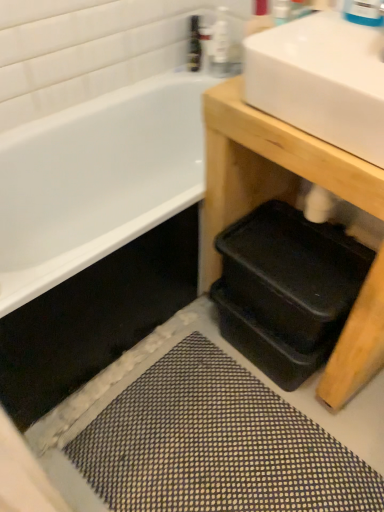
What is the approximate width of blue glossy faucet at upper right?

blue glossy faucet at upper right is 3.57 inches in width.

I want to click on clear plastic bottle at upper center, which is the second toiletry from left to right, so click(x=220, y=46).

The height and width of the screenshot is (512, 384). What are the coordinates of `blue glossy faucet at upper right` in the screenshot? It's located at (364, 12).

Is translucent plastic bottle at upper center, which ranks as the second toiletry in right-to-left order, in front of or behind textured gray bath mat at lower center in the image?

translucent plastic bottle at upper center, which ranks as the second toiletry in right-to-left order, is behind textured gray bath mat at lower center.

Looking at the image, does translucent plastic bottle at upper center, which is counted as the first toiletry, starting from the left, seem bigger or smaller compared to textured gray bath mat at lower center?

Considering their sizes, translucent plastic bottle at upper center, which is counted as the first toiletry, starting from the left, takes up less space than textured gray bath mat at lower center.

Between translucent plastic bottle at upper center, which ranks as the second toiletry in right-to-left order, and textured gray bath mat at lower center, which one has more height?

translucent plastic bottle at upper center, which ranks as the second toiletry in right-to-left order.

From a real-world perspective, which is physically below, translucent plastic bottle at upper center, which is counted as the first toiletry, starting from the left, or textured gray bath mat at lower center?

textured gray bath mat at lower center.

From a real-world perspective, is black plastic trays at lower right below white glossy sink at upper right?

Yes, from a real-world perspective, black plastic trays at lower right is below white glossy sink at upper right.

Identify the location of table below the white glossy sink at upper right (from a real-world perspective). Image resolution: width=384 pixels, height=512 pixels. (268, 167).

Can you confirm if black plastic trays at lower right is taller than white glossy sink at upper right?

Yes.

Considering the sizes of black plastic trays at lower right and white glossy sink at upper right in the image, is black plastic trays at lower right wider or thinner than white glossy sink at upper right?

Clearly, black plastic trays at lower right has more width compared to white glossy sink at upper right.

Is translucent plastic bottle at upper center, which is counted as the first toiletry, starting from the left, turned away from blue glossy faucet at upper right?

translucent plastic bottle at upper center, which is counted as the first toiletry, starting from the left, does not have its back to blue glossy faucet at upper right.

Does translucent plastic bottle at upper center, which is counted as the first toiletry, starting from the left, have a lesser height compared to blue glossy faucet at upper right?

Incorrect, the height of translucent plastic bottle at upper center, which is counted as the first toiletry, starting from the left, does not fall short of that of blue glossy faucet at upper right.

Where is `faucet that is in front of the translucent plastic bottle at upper center, which is counted as the first toiletry, starting from the left`? The height and width of the screenshot is (512, 384). faucet that is in front of the translucent plastic bottle at upper center, which is counted as the first toiletry, starting from the left is located at coordinates (364, 12).

Is blue glossy faucet at upper right looking in the opposite direction of clear plastic bottle at upper center, which is the second toiletry from left to right?

That's not correct — blue glossy faucet at upper right is not looking away from clear plastic bottle at upper center, which is the second toiletry from left to right.

From a real-world perspective, is blue glossy faucet at upper right located beneath clear plastic bottle at upper center, arranged as the 1th toiletry when viewed from the right?

Incorrect, from a real-world perspective, blue glossy faucet at upper right is higher than clear plastic bottle at upper center, arranged as the 1th toiletry when viewed from the right.

Consider the image. Visually, is blue glossy faucet at upper right positioned to the left or to the right of clear plastic bottle at upper center, arranged as the 1th toiletry when viewed from the right?

Clearly, blue glossy faucet at upper right is on the right of clear plastic bottle at upper center, arranged as the 1th toiletry when viewed from the right, in the image.

Starting from the blue glossy faucet at upper right, which toiletry is the 1st one behind? Please provide its 2D coordinates.

[(220, 46)]

Between point (226, 65) and point (197, 48), which one is positioned in front?

The point (226, 65) is closer.

Is clear plastic bottle at upper center, arranged as the 1th toiletry when viewed from the right, looking in the opposite direction of translucent plastic bottle at upper center, which ranks as the second toiletry in right-to-left order?

No, translucent plastic bottle at upper center, which ranks as the second toiletry in right-to-left order, is not at the back of clear plastic bottle at upper center, arranged as the 1th toiletry when viewed from the right.

Does clear plastic bottle at upper center, arranged as the 1th toiletry when viewed from the right, come behind translucent plastic bottle at upper center, which is counted as the first toiletry, starting from the left?

No, clear plastic bottle at upper center, arranged as the 1th toiletry when viewed from the right, is closer to the viewer.

Image resolution: width=384 pixels, height=512 pixels. I want to click on toiletry above the clear plastic bottle at upper center, arranged as the 1th toiletry when viewed from the right (from a real-world perspective), so click(195, 45).

From a real-world perspective, who is located lower, blue glossy faucet at upper right or textured gray bath mat at lower center?

In real-world perspective, textured gray bath mat at lower center is lower.

From the picture: From the image's perspective, is blue glossy faucet at upper right above or below textured gray bath mat at lower center?

blue glossy faucet at upper right is above textured gray bath mat at lower center.

Is point (381, 23) closer or farther from the camera than point (144, 393)?

Point (381, 23).

What's the angular difference between blue glossy faucet at upper right and textured gray bath mat at lower center's facing directions?

4.47 degrees separate the facing orientations of blue glossy faucet at upper right and textured gray bath mat at lower center.

From the image's perspective, is textured gray bath mat at lower center under black plastic trays at lower right?

Yes, from the image's perspective, textured gray bath mat at lower center is beneath black plastic trays at lower right.

Is textured gray bath mat at lower center positioned behind black plastic trays at lower right?

That is True.

Considering the sizes of objects textured gray bath mat at lower center and black plastic trays at lower right in the image provided, who is taller, textured gray bath mat at lower center or black plastic trays at lower right?

With more height is black plastic trays at lower right.

The image size is (384, 512). In order to click on bath mat below the translucent plastic bottle at upper center, which ranks as the second toiletry in right-to-left order (from the image's perspective) in this screenshot , I will do `click(207, 445)`.

I want to click on sink located above the black plastic trays at lower right (from the image's perspective), so click(321, 81).

Looking at the image, which one is located closer to black plastic trays at lower right, textured gray bath mat at lower center or clear plastic bottle at upper center, which is the second toiletry from left to right?

textured gray bath mat at lower center.

Based on the photo, from the image, which object appears to be nearer to clear plastic bottle at upper center, arranged as the 1th toiletry when viewed from the right, black plastic trays at lower right or textured gray bath mat at lower center?

black plastic trays at lower right.

From the image, which object appears to be farther from blue glossy faucet at upper right, clear plastic bottle at upper center, arranged as the 1th toiletry when viewed from the right, or textured gray bath mat at lower center?

The object further to blue glossy faucet at upper right is textured gray bath mat at lower center.

Looking at the image, which one is located further to white glossy sink at upper right, blue glossy faucet at upper right or clear plastic bottle at upper center, arranged as the 1th toiletry when viewed from the right?

The object further to white glossy sink at upper right is clear plastic bottle at upper center, arranged as the 1th toiletry when viewed from the right.

Looking at this image, based on their spatial positions, is clear plastic bottle at upper center, arranged as the 1th toiletry when viewed from the right, or translucent plastic bottle at upper center, which ranks as the second toiletry in right-to-left order, closer to blue glossy faucet at upper right?

Based on the image, clear plastic bottle at upper center, arranged as the 1th toiletry when viewed from the right, appears to be nearer to blue glossy faucet at upper right.

Based on their spatial positions, is blue glossy faucet at upper right or textured gray bath mat at lower center further from white glossy sink at upper right?

The object further to white glossy sink at upper right is textured gray bath mat at lower center.

Which object lies further to the anchor point clear plastic bottle at upper center, arranged as the 1th toiletry when viewed from the right, blue glossy faucet at upper right or textured gray bath mat at lower center?

Based on the image, textured gray bath mat at lower center appears to be further to clear plastic bottle at upper center, arranged as the 1th toiletry when viewed from the right.

Based on the photo, estimate the real-world distances between objects in this image. Which object is further from translucent plastic bottle at upper center, which is counted as the first toiletry, starting from the left, textured gray bath mat at lower center or white glossy sink at upper right?

Based on the image, textured gray bath mat at lower center appears to be further to translucent plastic bottle at upper center, which is counted as the first toiletry, starting from the left.

Where is `table that lies between translucent plastic bottle at upper center, which is counted as the first toiletry, starting from the left, and textured gray bath mat at lower center from top to bottom`? The image size is (384, 512). table that lies between translucent plastic bottle at upper center, which is counted as the first toiletry, starting from the left, and textured gray bath mat at lower center from top to bottom is located at coordinates (268, 167).

This screenshot has width=384, height=512. I want to click on sink that lies between blue glossy faucet at upper right and black plastic trays at lower right from top to bottom, so click(321, 81).

Where is `sink between blue glossy faucet at upper right and textured gray bath mat at lower center from top to bottom`? Image resolution: width=384 pixels, height=512 pixels. sink between blue glossy faucet at upper right and textured gray bath mat at lower center from top to bottom is located at coordinates (321, 81).

I want to click on faucet located between white glossy sink at upper right and clear plastic bottle at upper center, which is the second toiletry from left to right, in the depth direction, so click(364, 12).